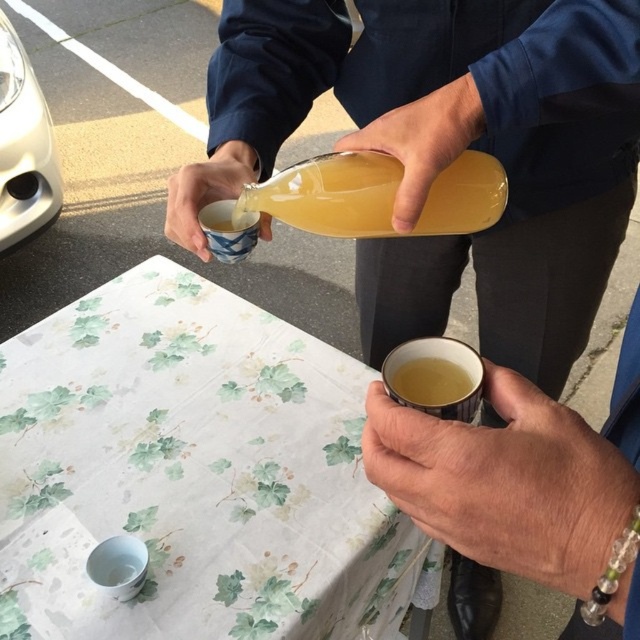
Question: Can you confirm if white floral tablecloth at center is smaller than yellow matte cup at lower center?

Choices:
 (A) no
 (B) yes

Answer: (A)

Question: Is translucent glass bottle at upper center positioned at the back of yellow translucent cup at lower center?

Choices:
 (A) yes
 (B) no

Answer: (A)

Question: In this image, where is white glossy car at upper left located relative to yellow matte cup at lower center?

Choices:
 (A) right
 (B) left

Answer: (B)

Question: Estimate the real-world distances between objects in this image. Which object is closer to the yellow translucent cup at lower center?

Choices:
 (A) matte ceramic cup at lower center
 (B) yellow matte cup at lower center
 (C) white floral tablecloth at center
 (D) white glossy car at upper left

Answer: (B)

Question: Which of the following is the farthest from the observer?

Choices:
 (A) (576, 189)
 (B) (301, 163)
 (C) (436, 381)
 (D) (474, 477)

Answer: (A)

Question: Estimate the real-world distances between objects in this image. Which object is farther from the matte ceramic cup at lower center?

Choices:
 (A) yellow translucent cup at lower center
 (B) translucent glass bottle at upper center
 (C) white floral tablecloth at center

Answer: (C)